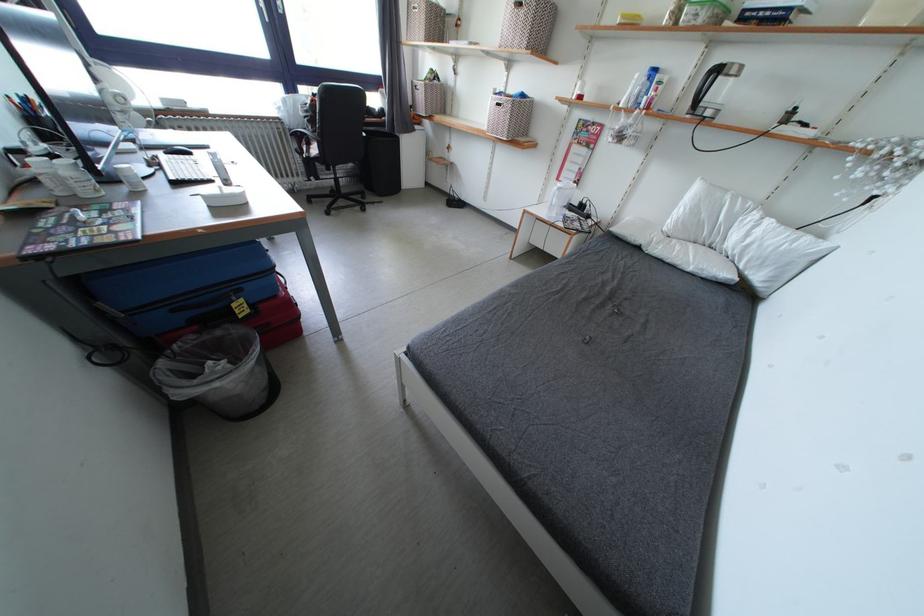
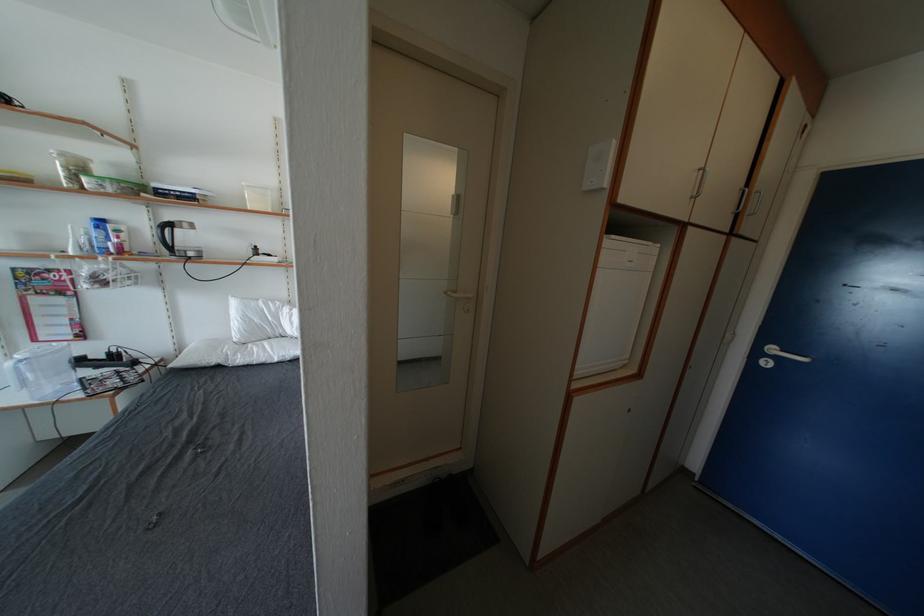
Find the pixel in the second image that matches (x=740, y=74) in the first image.

(191, 230)